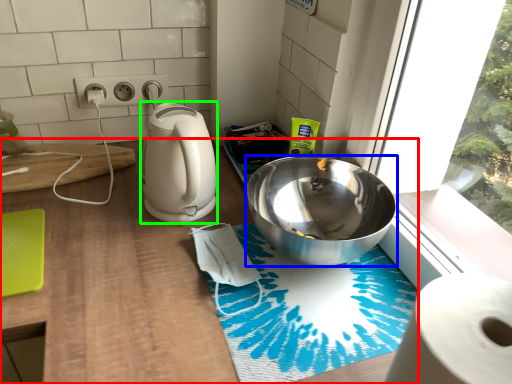
Question: Which object is the farthest from counter (highlighted by a red box)? Choose among these: bowl (highlighted by a blue box) or kitchen appliance (highlighted by a green box).

Choices:
 (A) bowl
 (B) kitchen appliance

Answer: (A)